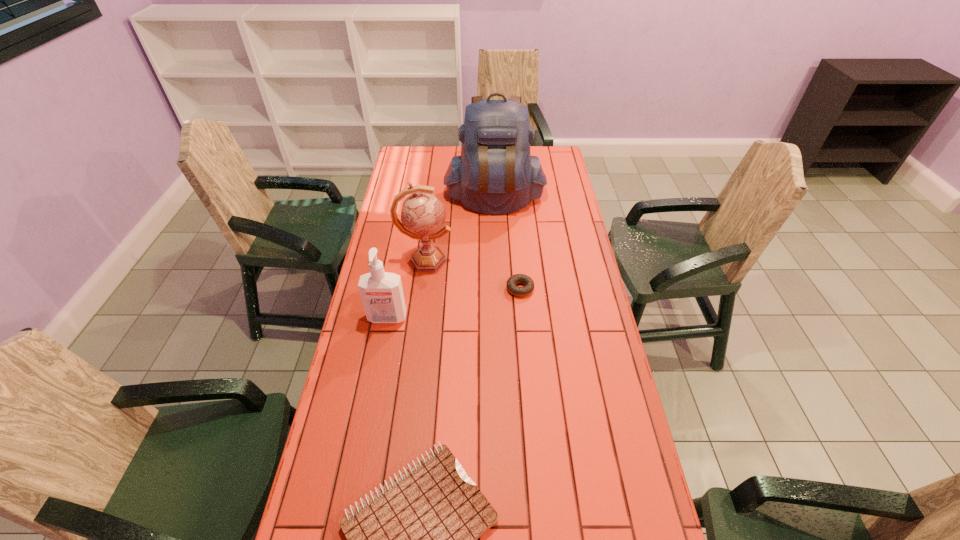
The width and height of the screenshot is (960, 540). Identify the location of empty location between the doughnut and the tallest object. (508, 244).

Choose which object is the fourth nearest neighbor to the third tallest object. Please provide its 2D coordinates. Your answer should be formatted as a tuple, i.e. [(x, y)], where the tuple contains the x and y coordinates of a point satisfying the conditions above.

[(495, 174)]

Select which object appears as the third closest to the backpack. Please provide its 2D coordinates. Your answer should be formatted as a tuple, i.e. [(x, y)], where the tuple contains the x and y coordinates of a point satisfying the conditions above.

[(381, 292)]

The image size is (960, 540). Identify the location of free space that satisfies the following two spatial constraints: 1. on the front-facing side of the globe; 2. on the back side of the doughnut. (421, 288).

Identify the location of free space that satisfies the following two spatial constraints: 1. on the front-facing side of the second farthest object; 2. on the right side of the doughnut. (421, 288).

Find the location of a particular element. The height and width of the screenshot is (540, 960). free spot that satisfies the following two spatial constraints: 1. on the front-facing side of the fourth nearest object; 2. on the front label of the third shortest object is located at coordinates (419, 319).

The height and width of the screenshot is (540, 960). I want to click on blank space that satisfies the following two spatial constraints: 1. at the front pocket of the backpack; 2. on the right side of the doughnut, so click(x=498, y=288).

At what (x,y) coordinates should I click in order to perform the action: click on blank area in the image that satisfies the following two spatial constraints: 1. on the back side of the doughnut; 2. on the front-facing side of the second farthest object. Please return your answer as a coordinate pair (x, y). The height and width of the screenshot is (540, 960). Looking at the image, I should click on (517, 260).